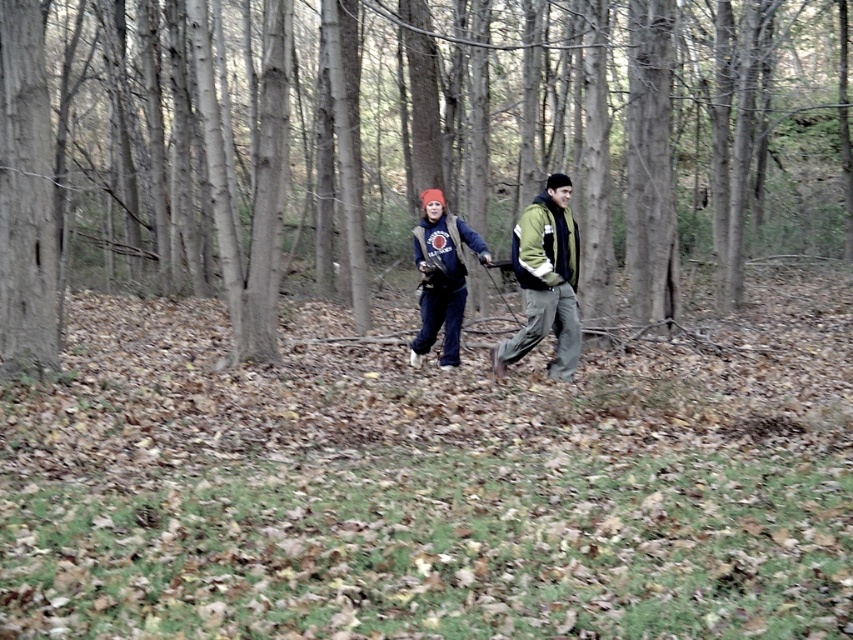
You are planning to take a photo of the brown bark tree at center and the matte blue sweatshirt at center. Which object is wider in the scene?

The brown bark tree at center is wider than the matte blue sweatshirt at center according to the description.

You are planning to take a photo of the brown bark tree at center and the matte blue jacket at center from a distance. Considering their sizes, which one will appear larger in the photo?

The brown bark tree at center is much taller than the matte blue jacket at center, so it will appear larger in the photo.

You are a hiker trying to decide which of the two blue items to take for warmth. The matte blue jacket at center and the matte blue sweatshirt at center are both available. Based on their sizes, which one might provide more coverage and warmth?

The matte blue jacket at center is taller than the matte blue sweatshirt at center, so it might provide more coverage and warmth.